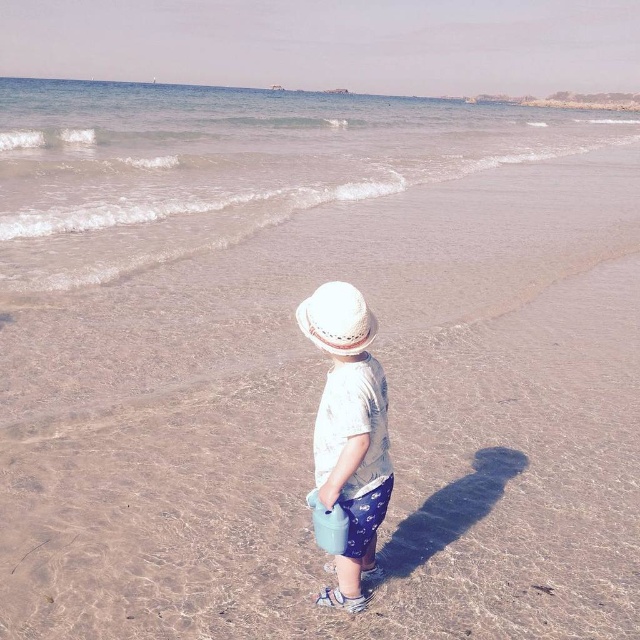
Question: In this image, where is white woven hat at center located relative to white straw hat at center?

Choices:
 (A) below
 (B) above

Answer: (A)

Question: Is white woven hat at center below white straw hat at center?

Choices:
 (A) yes
 (B) no

Answer: (A)

Question: Does white woven hat at center appear on the left side of white straw hat at center?

Choices:
 (A) no
 (B) yes

Answer: (A)

Question: Which of these objects is positioned farthest from the white woven hat at center?

Choices:
 (A) white straw hat at center
 (B) clear water at upper center

Answer: (B)

Question: Which point is closer to the camera taking this photo?

Choices:
 (A) (244, 177)
 (B) (368, 410)
 (C) (326, 339)

Answer: (C)

Question: Which point is closer to the camera?

Choices:
 (A) (355, 291)
 (B) (77, 212)
 (C) (307, 316)

Answer: (A)